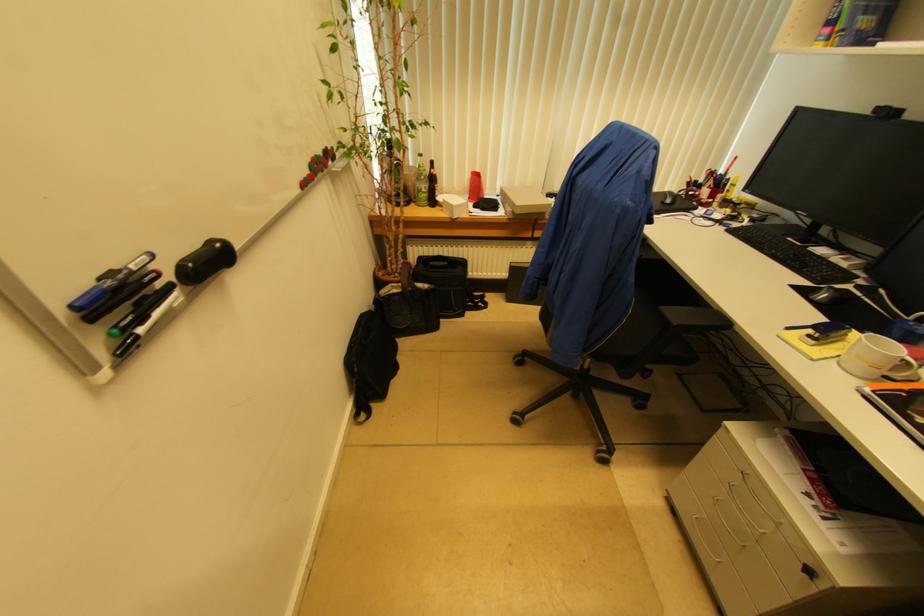
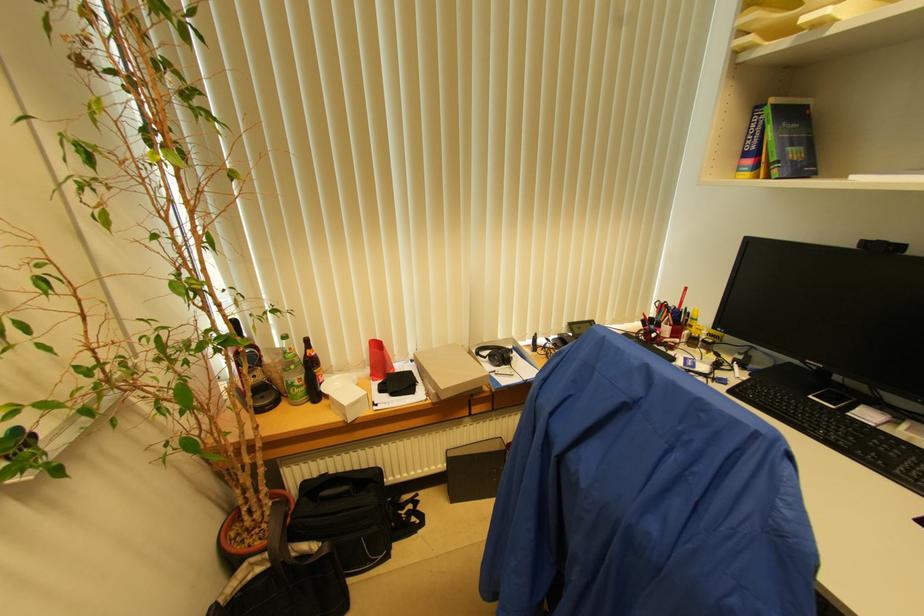
Question: The first image is from the beginning of the video and the second image is from the end. How did the camera likely rotate when shooting the video?

Choices:
 (A) Left
 (B) Right
 (C) Up
 (D) Down

Answer: (C)